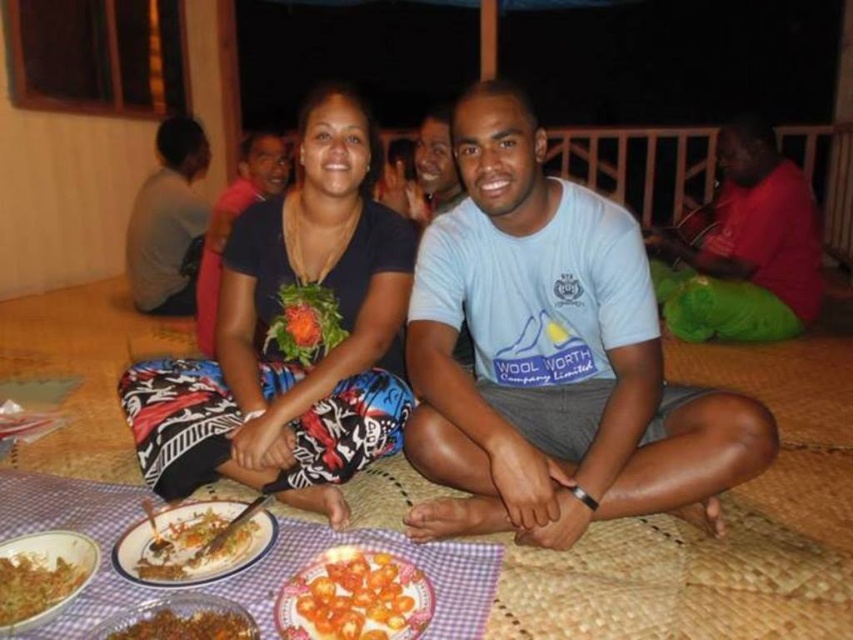
You are standing in front of the scene and want to reach the red cotton shirt at upper right. Considering your height is 1.7 meters, can you comfortably touch it without stretching?

The red cotton shirt at upper right is 3.05 meters away from the viewer. Since the distance is greater than the average arm length of 1.5 meters, you cannot comfortably touch it without moving closer.